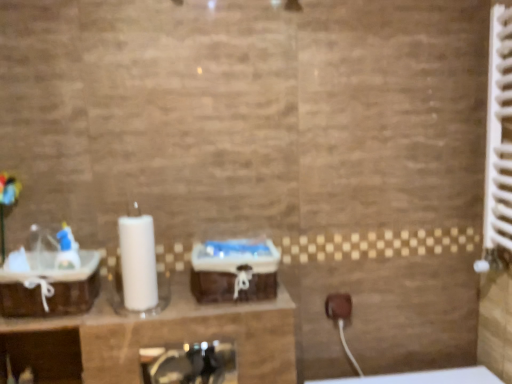
The height and width of the screenshot is (384, 512). What do you see at coordinates (50, 277) in the screenshot?
I see `brown woven basket at left` at bounding box center [50, 277].

What is the approximate height of brown woven basket at left?

It is 5.17 inches.

Where is `brown woven basket at left`? The height and width of the screenshot is (384, 512). brown woven basket at left is located at coordinates (50, 277).

In order to face brown woven basket at left, should I rotate leftwards or rightwards?

Rotate left and turn 24.783 degrees.

Where is `white plastic radiator at right`? The width and height of the screenshot is (512, 384). white plastic radiator at right is located at coordinates (499, 132).

The height and width of the screenshot is (384, 512). Describe the element at coordinates (499, 132) in the screenshot. I see `white plastic radiator at right` at that location.

Where is `brown woven basket at left`? This screenshot has width=512, height=384. brown woven basket at left is located at coordinates (50, 277).

Visually, is brown woven basket at left positioned to the left or to the right of white plastic radiator at right?

Based on their positions, brown woven basket at left is located to the left of white plastic radiator at right.

Is brown woven basket at left behind white plastic radiator at right?

Yes.

Considering the positions of point (50, 298) and point (509, 168), is point (50, 298) closer or farther from the camera than point (509, 168)?

Point (50, 298).

From the image's perspective, which object appears higher, brown woven basket at left or white plastic radiator at right?

From the image's view, white plastic radiator at right is above.

From a real-world perspective, is brown woven basket at left positioned under white plastic radiator at right based on gravity?

Yes, from a real-world perspective, brown woven basket at left is beneath white plastic radiator at right.

Which object is wider, brown woven basket at left or white plastic radiator at right?

brown woven basket at left.

Between brown woven basket at left and white plastic radiator at right, which one has less height?

Standing shorter between the two is brown woven basket at left.

Is brown woven basket at left smaller than white plastic radiator at right?

Correct, brown woven basket at left occupies less space than white plastic radiator at right.

Is brown woven basket at left inside or outside of white plastic radiator at right?

brown woven basket at left is not inside white plastic radiator at right, it's outside.

Is brown woven basket at left touching white plastic radiator at right?

No.

Is brown woven basket at left facing away from white plastic radiator at right?

No, brown woven basket at left's orientation is not away from white plastic radiator at right.

What's the angular difference between brown woven basket at left and white plastic radiator at right's facing directions?

They differ by 87.9 degrees in their facing directions.

The image size is (512, 384). Identify the location of sink below the white plastic radiator at right (from a real-world perspective). (50, 277).

Considering the positions of objects white plastic radiator at right and brown woven basket at left in the image provided, who is more to the right, white plastic radiator at right or brown woven basket at left?

From the viewer's perspective, white plastic radiator at right appears more on the right side.

Is the position of white plastic radiator at right less distant than that of brown woven basket at left?

Yes, white plastic radiator at right is closer to the camera.

Considering the points (495, 149) and (76, 247), which point is in front, point (495, 149) or point (76, 247)?

The point (76, 247) is closer.

From the image's perspective, relative to brown woven basket at left, is white plastic radiator at right above or below?

Clearly, from the image's perspective, white plastic radiator at right is above brown woven basket at left.

From the picture: From a real-world perspective, between white plastic radiator at right and brown woven basket at left, who is vertically lower?

From a 3D spatial view, brown woven basket at left is below.

Considering the relative sizes of white plastic radiator at right and brown woven basket at left in the image provided, is white plastic radiator at right wider than brown woven basket at left?

Incorrect, the width of white plastic radiator at right does not surpass that of brown woven basket at left.

Which of these two, white plastic radiator at right or brown woven basket at left, stands taller?

white plastic radiator at right is taller.

Considering the sizes of objects white plastic radiator at right and brown woven basket at left in the image provided, who is smaller, white plastic radiator at right or brown woven basket at left?

With smaller size is brown woven basket at left.

Based on the photo, is brown woven basket at left completely or partially inside white plastic radiator at right?

Actually, brown woven basket at left is outside white plastic radiator at right.

Can you see white plastic radiator at right touching brown woven basket at left?

No, white plastic radiator at right is not next to brown woven basket at left.

Consider the image. Is white plastic radiator at right turned away from brown woven basket at left?

No, white plastic radiator at right is not facing the opposite direction of brown woven basket at left.

How distant is white plastic radiator at right from brown woven basket at left?

4.09 feet.

The height and width of the screenshot is (384, 512). In the image, there is a brown woven basket at left. In order to click on radiator above it (from the image's perspective) in this screenshot , I will do `click(499, 132)`.

Locate an element on the screen. radiator to the right of brown woven basket at left is located at coordinates (499, 132).

At what (x,y) coordinates should I click in order to perform the action: click on sink behind the white plastic radiator at right. Please return your answer as a coordinate pair (x, y). This screenshot has width=512, height=384. Looking at the image, I should click on (50, 277).